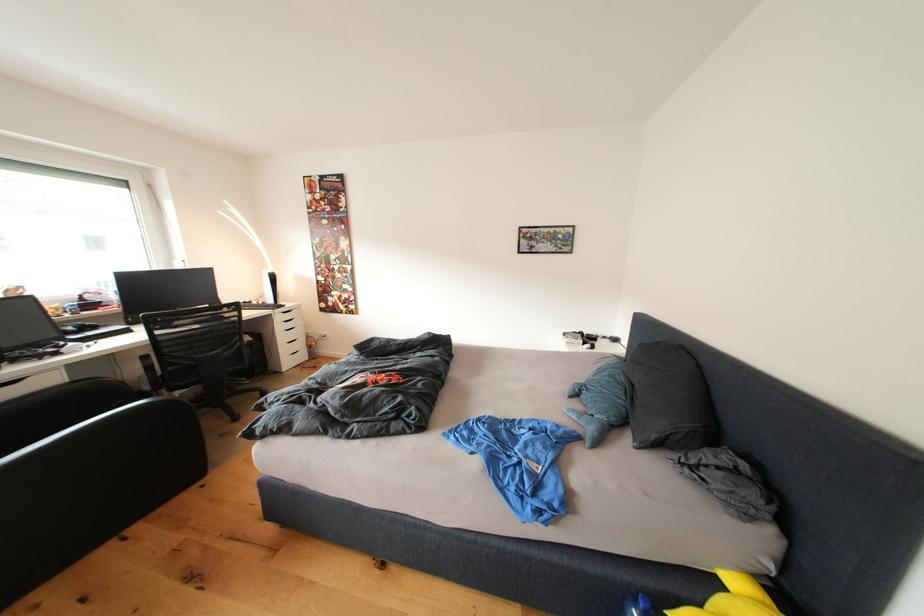
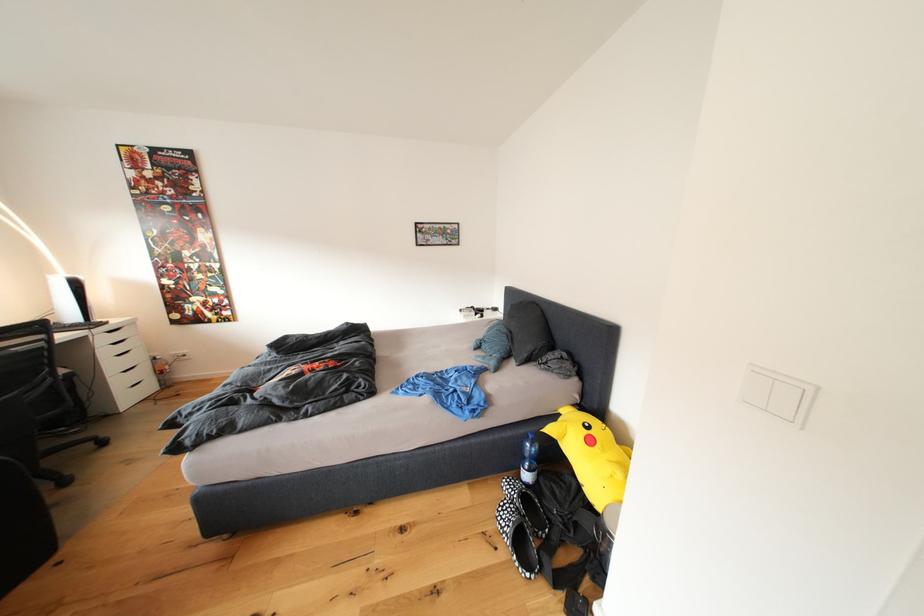
Find the pixel in the second image that matches (x=574, y=339) in the first image.

(469, 315)